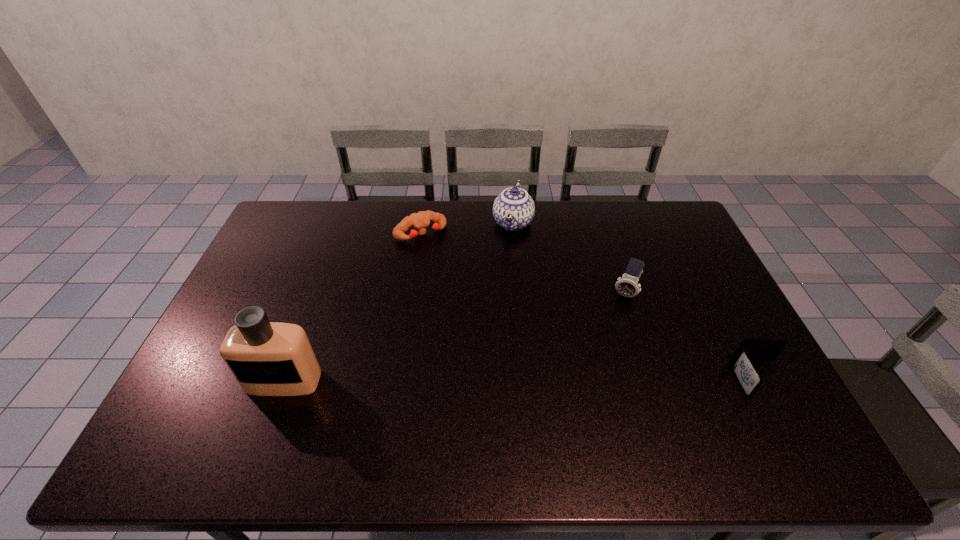
Where is `free space on the desktop that is between the leftmost object and the wallet and is positioned from the spout of the chinaware`? The image size is (960, 540). free space on the desktop that is between the leftmost object and the wallet and is positioned from the spout of the chinaware is located at coordinates (456, 380).

Locate an element on the screen. The image size is (960, 540). free space on the desktop that is between the perfume and the wallet and is positioned on the face of the fourth object from left to right is located at coordinates (588, 380).

Where is `free space on the desktop that is between the tallest object and the rightmost object and is positioned with the gloves of the puncher facing forward`? The width and height of the screenshot is (960, 540). free space on the desktop that is between the tallest object and the rightmost object and is positioned with the gloves of the puncher facing forward is located at coordinates (520, 380).